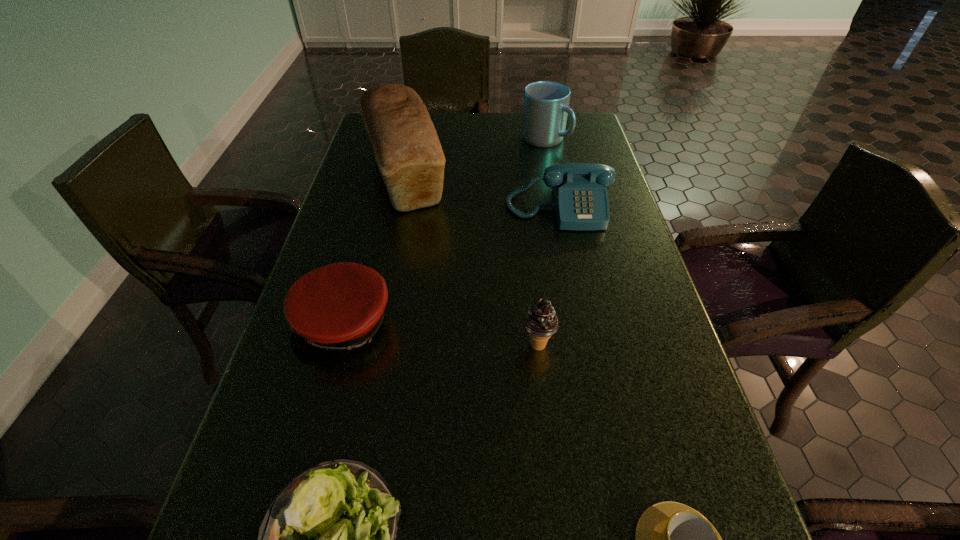
Find the location of `the tallest object`. the tallest object is located at coordinates (407, 149).

At what (x,y) coordinates should I click in order to perform the action: click on mug. Please return your answer as a coordinate pair (x, y). Image resolution: width=960 pixels, height=540 pixels. Looking at the image, I should click on (546, 103).

Find the location of a particular element. This screenshot has width=960, height=540. icecream is located at coordinates (540, 321).

Find the location of a particular element. telephone is located at coordinates (580, 195).

This screenshot has width=960, height=540. I want to click on cap, so click(332, 310).

The height and width of the screenshot is (540, 960). Identify the location of vacant space positioned 0.300m on the front of the tallest object. click(378, 308).

At what (x,y) coordinates should I click in order to perform the action: click on vacant space situated 0.240m on the front of the mug. Please return your answer as a coordinate pair (x, y). The width and height of the screenshot is (960, 540). Looking at the image, I should click on pos(557,198).

Find the location of a particular element. The width and height of the screenshot is (960, 540). blank space located 0.350m on the back of the icecream is located at coordinates (524, 222).

At what (x,y) coordinates should I click in order to perform the action: click on blank space located 0.170m on the dial of the telephone. Please return your answer as a coordinate pair (x, y). Looking at the image, I should click on (573, 281).

Where is `free location located 0.140m on the front-facing side of the cap`? Image resolution: width=960 pixels, height=540 pixels. free location located 0.140m on the front-facing side of the cap is located at coordinates (315, 436).